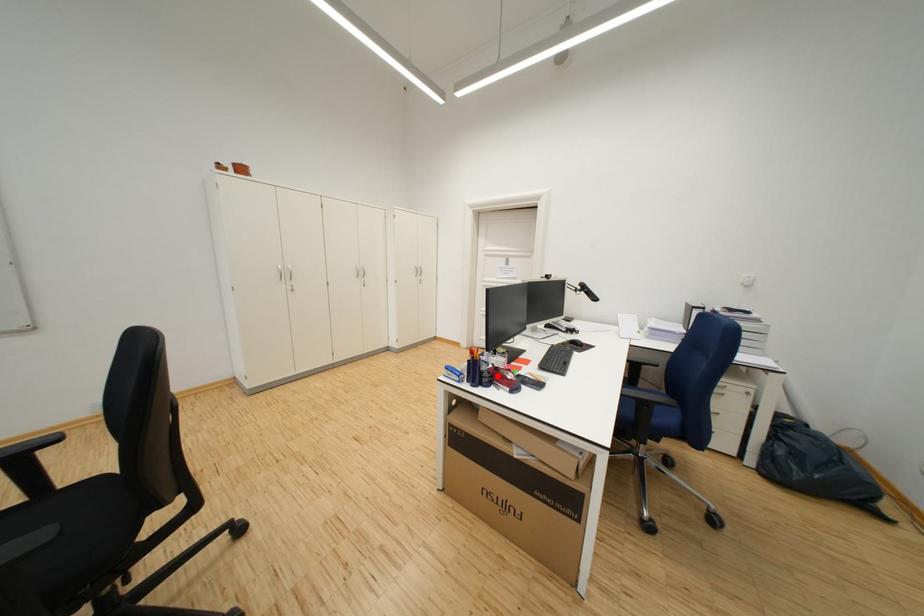
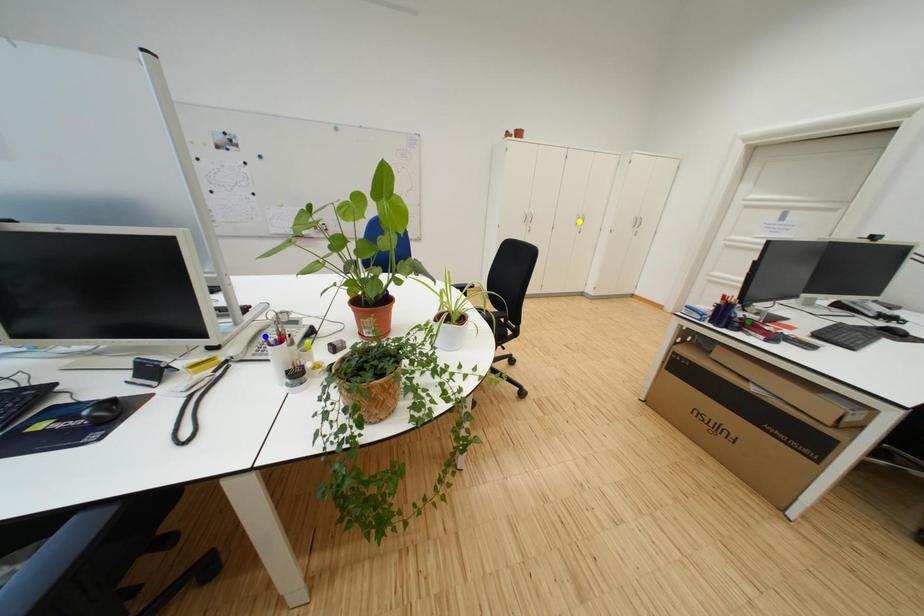
Question: I am providing you with two images of the same scene from different viewpoints. A red point is marked on the first image. You are given multiple points on the second image. Can you choose the point in image 2 that corresponds to the point in image 1?

Choices:
 (A) blue point
 (B) yellow point
 (C) green point

Answer: (C)